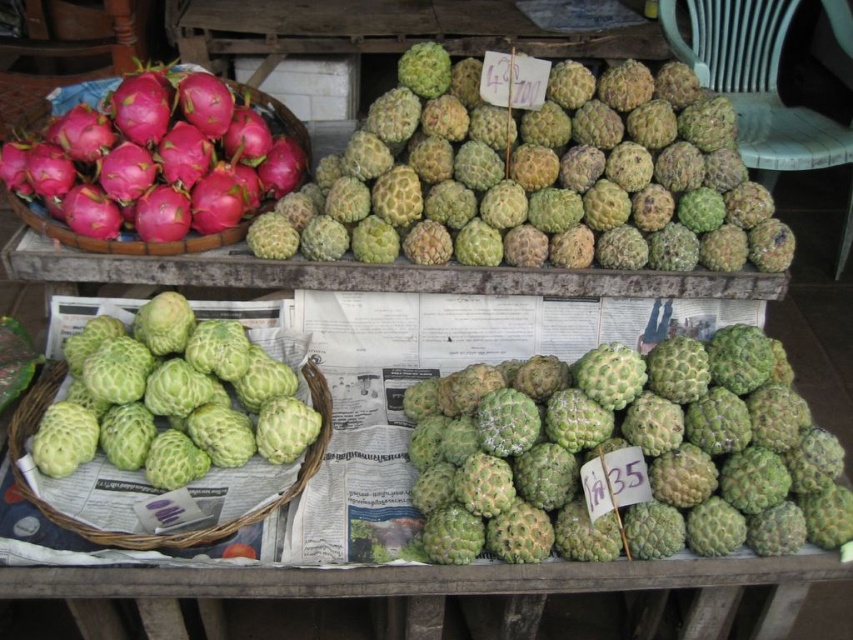
How much distance is there between green matte cherimoya at center and pink matte dragon fruit basket at left?

green matte cherimoya at center is 30.96 centimeters from pink matte dragon fruit basket at left.

Consider the image. Who is more forward, (x=90, y=445) or (x=260, y=97)?

Point (x=90, y=445) is more forward.

Where is `green matte cherimoya at center`? green matte cherimoya at center is located at coordinates pos(173,397).

This screenshot has width=853, height=640. Describe the element at coordinates (628, 452) in the screenshot. I see `green rough custard apple at center` at that location.

Does point (637, 420) lie behind point (308, 138)?

That is False.

Locate an element on the screen. green rough custard apple at center is located at coordinates (628, 452).

Does point (722, 262) come in front of point (463, 406)?

No, it is not.

Between green rough durian at upper center and green rough custard apple at center, which one is positioned lower?

green rough custard apple at center

Between point (606, 77) and point (724, 385), which one is positioned behind?

Point (606, 77)

This screenshot has width=853, height=640. Identify the location of green rough durian at upper center. (537, 179).